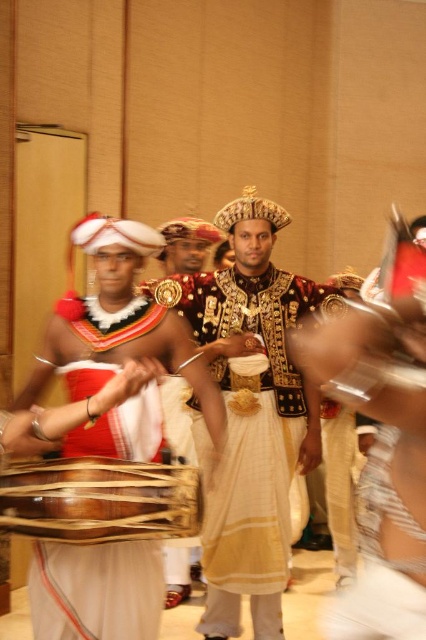
Between gold textured fabric at center and wooden drum at center, which one is positioned higher?

gold textured fabric at center is higher up.

Does gold textured fabric at center have a larger size compared to wooden drum at center?

Yes, gold textured fabric at center is bigger than wooden drum at center.

Is point (235, 321) closer to camera compared to point (88, 476)?

No, it is not.

You are a GUI agent. You are given a task and a screenshot of the screen. Output one action in this format:
    pyautogui.click(x=<x>, y=<y>)
    Task: Click on the gold textured fabric at center
    
    Given the screenshot: What is the action you would take?
    coord(261,422)